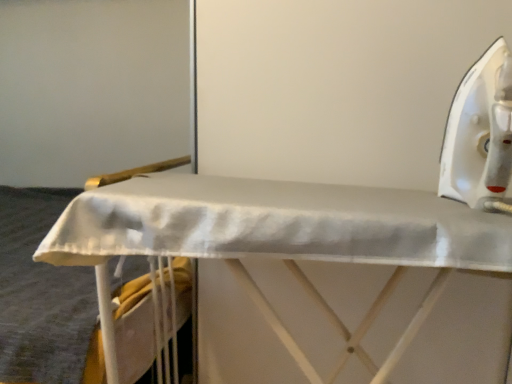
Image resolution: width=512 pixels, height=384 pixels. Describe the element at coordinates (480, 134) in the screenshot. I see `white glossy iron at upper right` at that location.

Find the location of a particular element. The width and height of the screenshot is (512, 384). white glossy iron at upper right is located at coordinates (480, 134).

Measure the distance between point [495,109] and camera.

A distance of 24.53 inches exists between point [495,109] and camera.

The image size is (512, 384). I want to click on white glossy iron at upper right, so click(x=480, y=134).